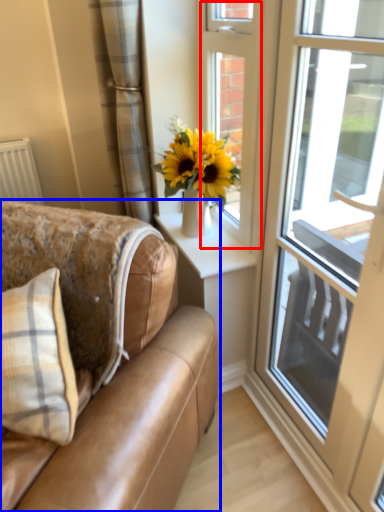
Question: Which point is further to the camera, door (highlighted by a red box) or studio couch (highlighted by a blue box)?

Choices:
 (A) door
 (B) studio couch

Answer: (A)